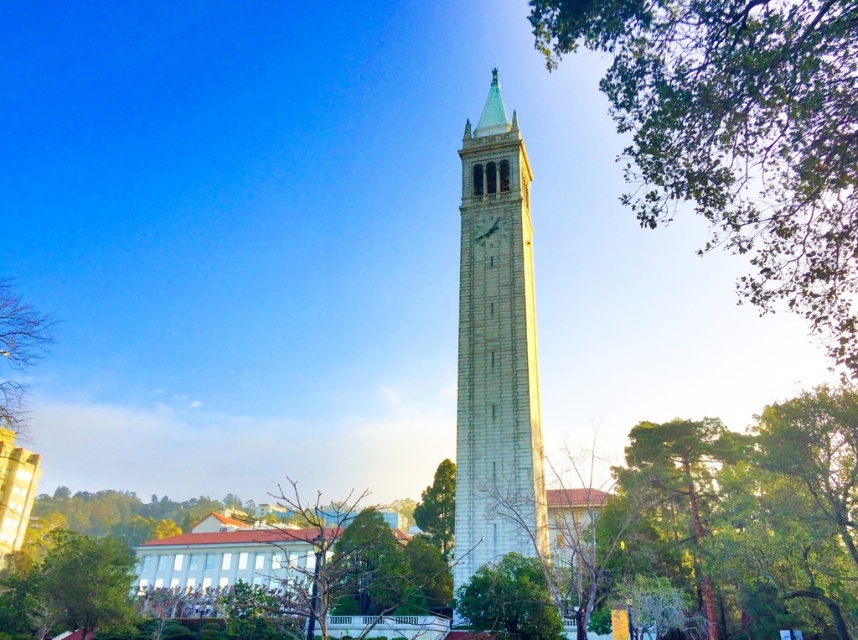
You are an architect designing a new garden layout and need to place two green leafy trees. The scene shows a green leafy tree at upper right and a green leafy tree at lower center. Which tree in the scene is bigger?

The green leafy tree at upper right is larger in size compared to the green leafy tree at lower center.